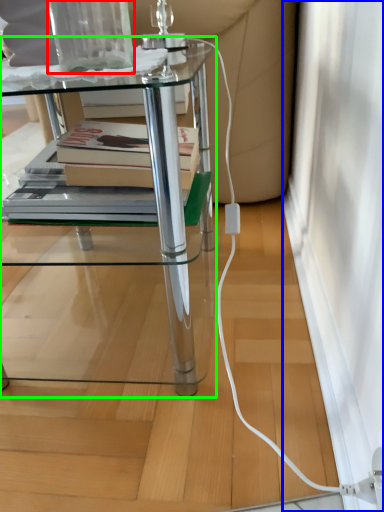
Question: Considering the real-world distances, which object is farthest from glass vase (highlighted by a red box)? screen door (highlighted by a blue box) or table (highlighted by a green box)?

Choices:
 (A) screen door
 (B) table

Answer: (A)